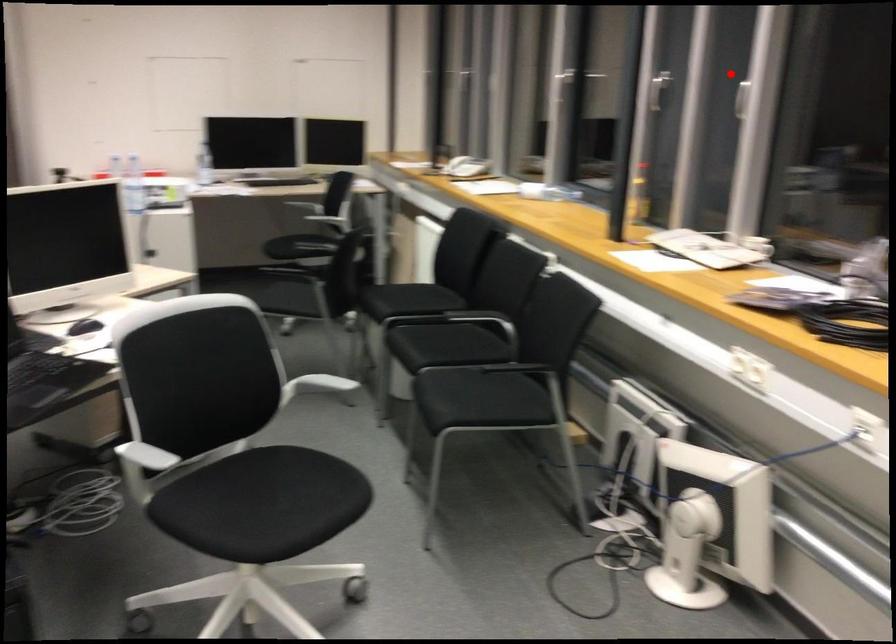
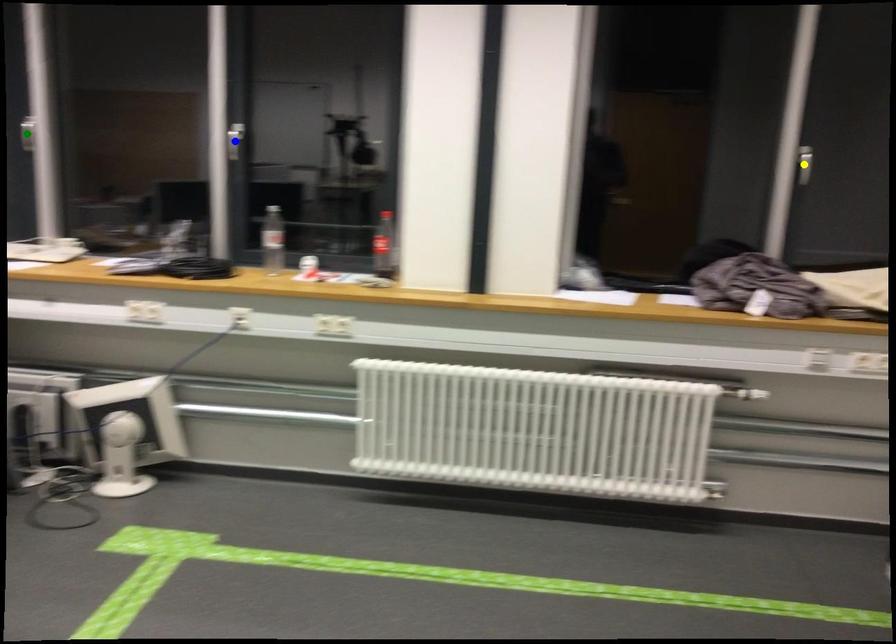
Question: I am providing you with two images of the same scene from different viewpoints. A red point is marked on the first image. You are given multiple points on the second image. In image 2, which mark is for the same physical point as the one in image 1?

Choices:
 (A) blue point
 (B) yellow point
 (C) green point

Answer: (C)